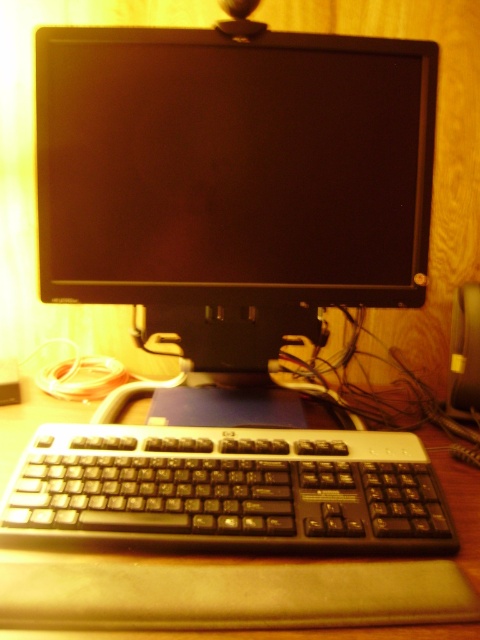
Question: Does black matte monitor at center have a smaller size compared to brown wooden table at center?

Choices:
 (A) no
 (B) yes

Answer: (B)

Question: Is black matte monitor at center wider than black plastic keyboard at lower center?

Choices:
 (A) yes
 (B) no

Answer: (A)

Question: Among these objects, which one is farthest from the camera?

Choices:
 (A) brown wooden table at center
 (B) black plastic keyboard at lower center

Answer: (B)

Question: Is black matte monitor at center thinner than black plastic keyboard at lower center?

Choices:
 (A) no
 (B) yes

Answer: (A)

Question: Which point is farther to the camera?

Choices:
 (A) brown wooden table at center
 (B) black plastic keyboard at lower center

Answer: (B)

Question: Which point appears farthest from the camera in this image?

Choices:
 (A) (86, 200)
 (B) (264, 438)
 (C) (335, 588)

Answer: (A)